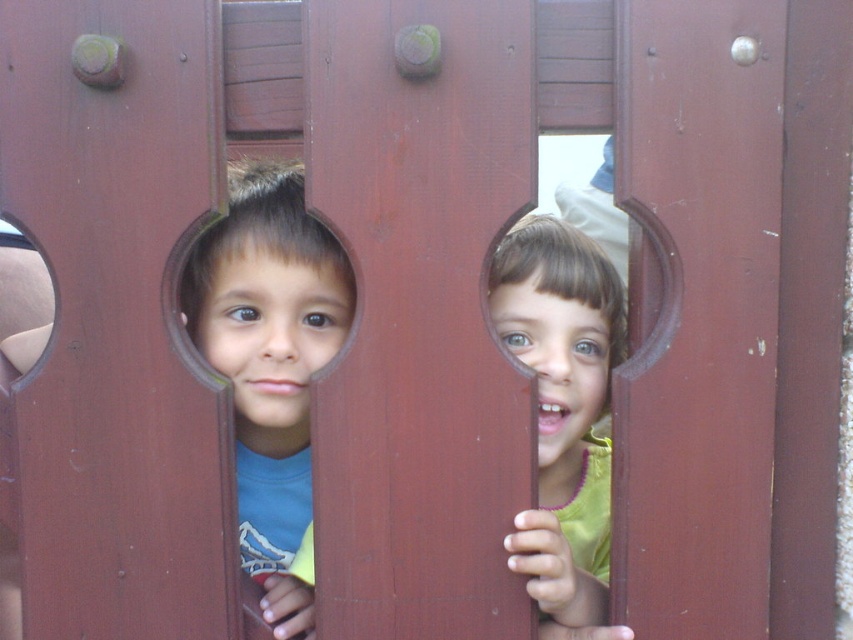
Between matte green shirt at center and matte plastic hole at left, which one appears on the left side from the viewer's perspective?

matte plastic hole at left is more to the left.

Is matte green shirt at center to the left of matte plastic hole at left from the viewer's perspective?

In fact, matte green shirt at center is to the right of matte plastic hole at left.

Locate an element on the screen. The image size is (853, 640). matte green shirt at center is located at coordinates (561, 406).

Which of these two, matte blue shirt at left or matte plastic hole at left, stands taller?

With more height is matte blue shirt at left.

The image size is (853, 640). What do you see at coordinates (270, 364) in the screenshot?
I see `matte blue shirt at left` at bounding box center [270, 364].

Who is more distant from viewer, (242, 193) or (10, 380)?

Positioned behind is point (10, 380).

Locate an element on the screen. matte blue shirt at left is located at coordinates (270, 364).

Can you confirm if matte blue shirt at left is smaller than matte green shirt at center?

Actually, matte blue shirt at left might be larger than matte green shirt at center.

Consider the image. Does matte blue shirt at left have a lesser width compared to matte green shirt at center?

No.

This screenshot has width=853, height=640. Find the location of `matte blue shirt at left`. matte blue shirt at left is located at coordinates (270, 364).

Image resolution: width=853 pixels, height=640 pixels. Find the location of `matte blue shirt at left`. matte blue shirt at left is located at coordinates (270, 364).